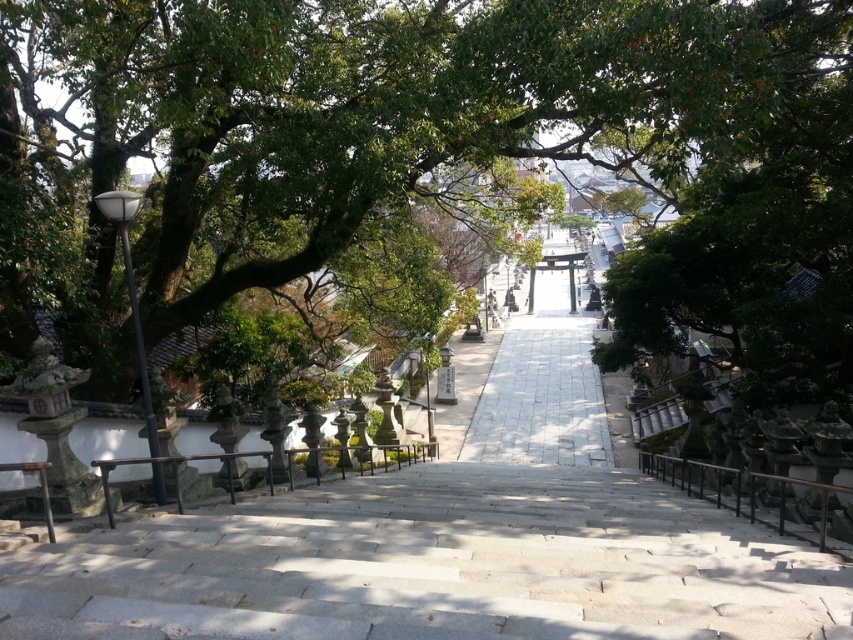
The height and width of the screenshot is (640, 853). Describe the element at coordinates (434, 564) in the screenshot. I see `gray stone stairs at center` at that location.

Can you confirm if gray stone stairs at center is positioned below white stone path at center?

Yes.

Locate an element on the screen. gray stone stairs at center is located at coordinates (434, 564).

What are the coordinates of `gray stone stairs at center` in the screenshot? It's located at (434, 564).

Which of these two, white stone path at center or black metal/rail at lower right, stands taller?

With more height is white stone path at center.

Can you confirm if white stone path at center is positioned to the right of black metal/rail at lower right?

Indeed, white stone path at center is positioned on the right side of black metal/rail at lower right.

Who is more distant from viewer, (578, 336) or (700, 497)?

The point (578, 336) is more distant.

The image size is (853, 640). Find the location of `white stone path at center`. white stone path at center is located at coordinates (543, 387).

Between green leafy tree at center and black metal/rail at lower right, which one appears on the left side from the viewer's perspective?

black metal/rail at lower right

Between green leafy tree at center and black metal/rail at lower right, which one is positioned higher?

green leafy tree at center is above.

Is point (567, 90) positioned behind point (758, 486)?

No, it is in front of (758, 486).

Identify the location of green leafy tree at center. (428, 148).